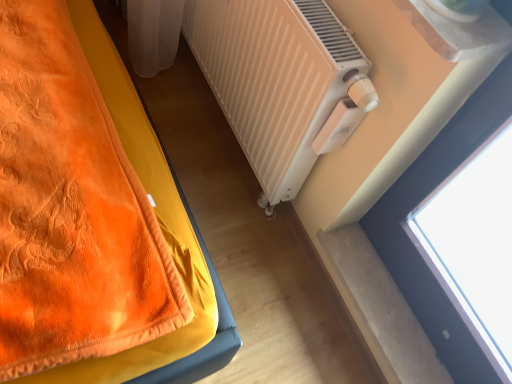
Where is `white matte radiator at center`? This screenshot has height=384, width=512. white matte radiator at center is located at coordinates (273, 78).

What do you see at coordinates (273, 78) in the screenshot? I see `white matte radiator at center` at bounding box center [273, 78].

At what (x,y) coordinates should I click in order to perform the action: click on white matte radiator at center. Please return your answer as a coordinate pair (x, y). This screenshot has width=512, height=384. Looking at the image, I should click on (273, 78).